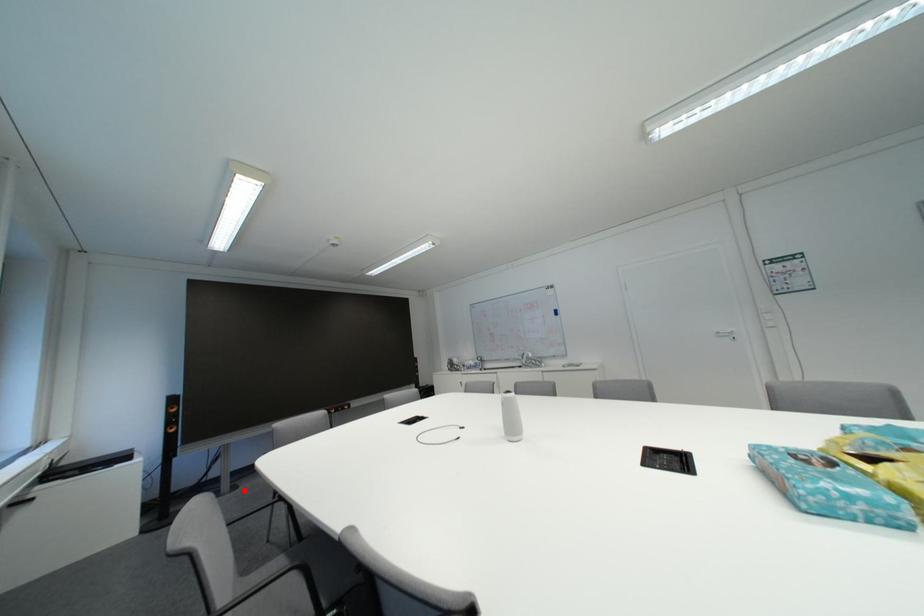
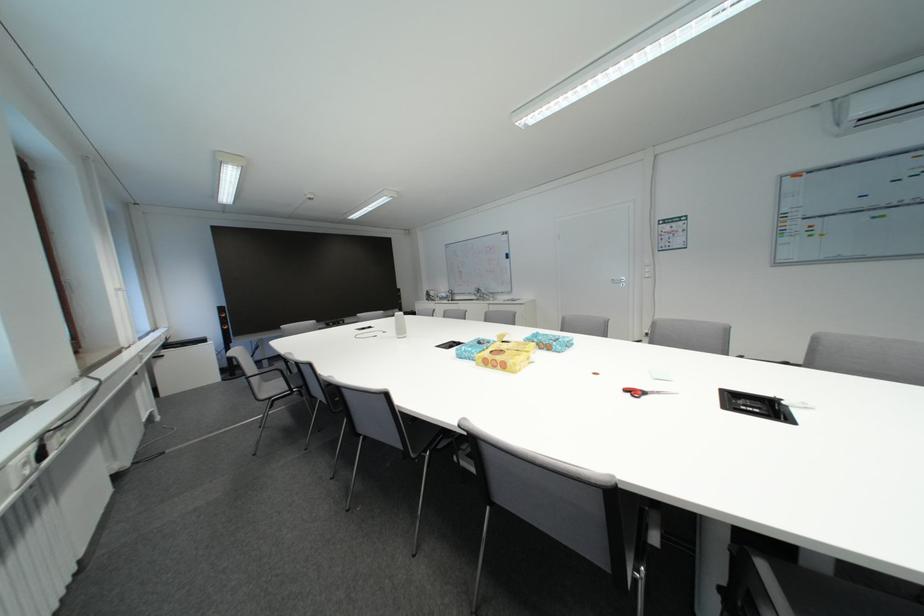
The point at the highlighted location is marked in the first image. Where is the corresponding point in the second image?

(282, 368)